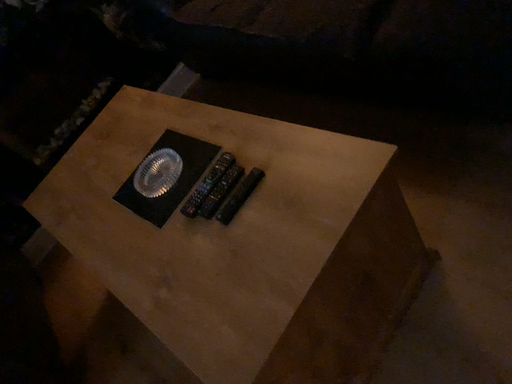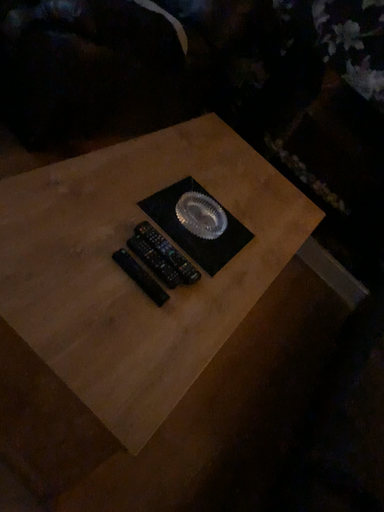
Question: How did the camera likely rotate when shooting the video?

Choices:
 (A) rotated downward
 (B) rotated upward

Answer: (B)